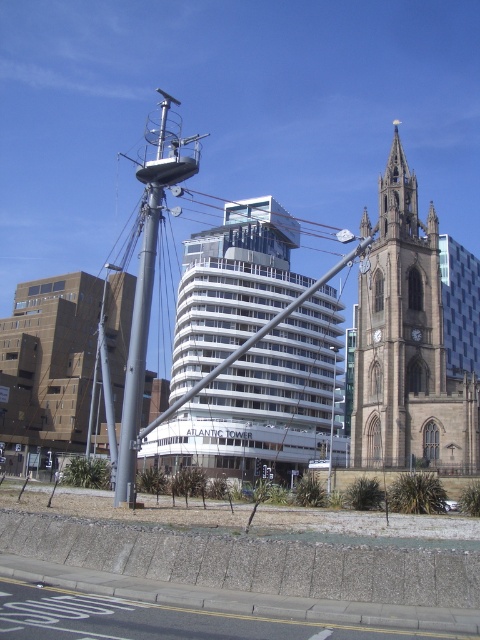
Can you confirm if brown stone clock tower at center is taller than polished silver spire at center?

No.

You are a GUI agent. You are given a task and a screenshot of the screen. Output one action in this format:
    pyautogui.click(x=<x>, y=<y>)
    Task: Click on the brown stone clock tower at center
    This screenshot has width=480, height=640.
    Given the screenshot: What is the action you would take?
    pyautogui.click(x=398, y=330)

You are a GUI agent. You are given a task and a screenshot of the screen. Output one action in this format:
    pyautogui.click(x=<x>, y=<y>)
    Task: Click on the brown stone clock tower at center
    This screenshot has width=480, height=640.
    Given the screenshot: What is the action you would take?
    pyautogui.click(x=398, y=330)

Is brown stone clock tower at center below brown brick church at center?

No, brown stone clock tower at center is not below brown brick church at center.

You are a GUI agent. You are given a task and a screenshot of the screen. Output one action in this format:
    pyautogui.click(x=<x>, y=<y>)
    Task: Click on the brown stone clock tower at center
    This screenshot has width=480, height=640.
    Given the screenshot: What is the action you would take?
    pyautogui.click(x=398, y=330)

What are the coordinates of `brown stone clock tower at center` in the screenshot? It's located at (398, 330).

Is brown brick church at center taller than polished silver spire at center?

Incorrect, brown brick church at center's height is not larger of polished silver spire at center's.

Is point (52, 349) positioned in front of point (137, 323)?

No.

At what (x,y) coordinates should I click in order to perform the action: click on brown brick church at center. Please return your answer as a coordinate pair (x, y). Looking at the image, I should click on (48, 369).